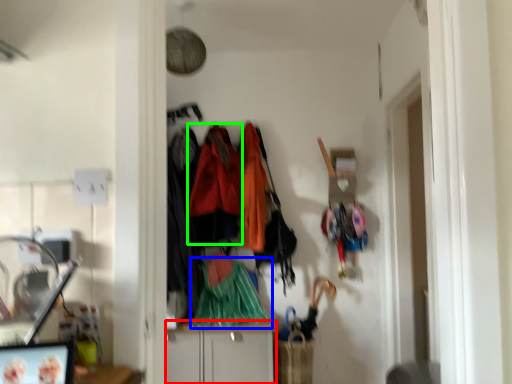
Question: Which object is positioned farthest from cabinetry (highlighted by a red box)? Select from clothing (highlighted by a blue box) and clothing (highlighted by a green box).

Choices:
 (A) clothing
 (B) clothing

Answer: (B)